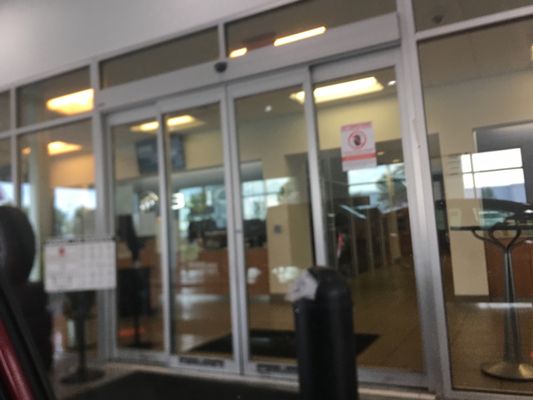
The width and height of the screenshot is (533, 400). Identify the location of mats. (260, 336), (199, 394).